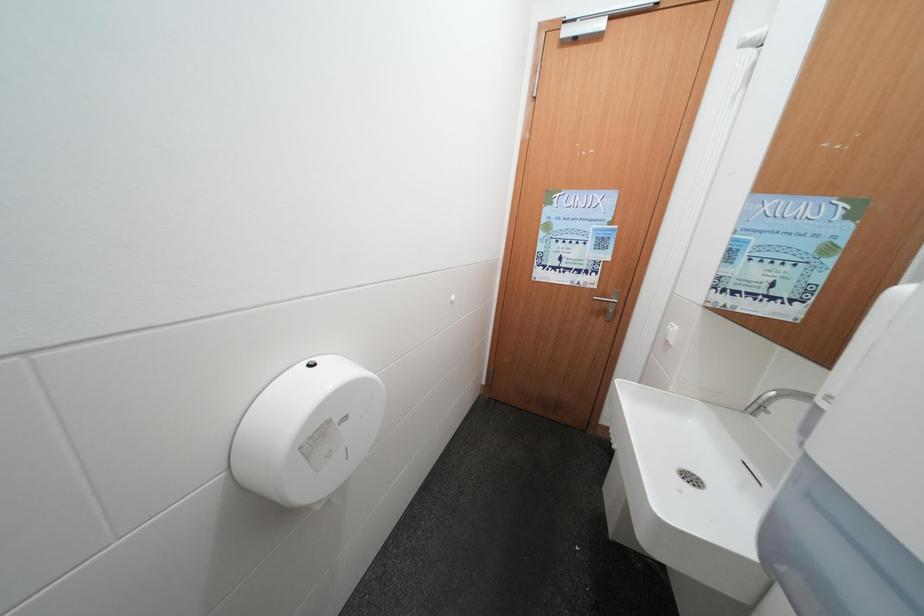
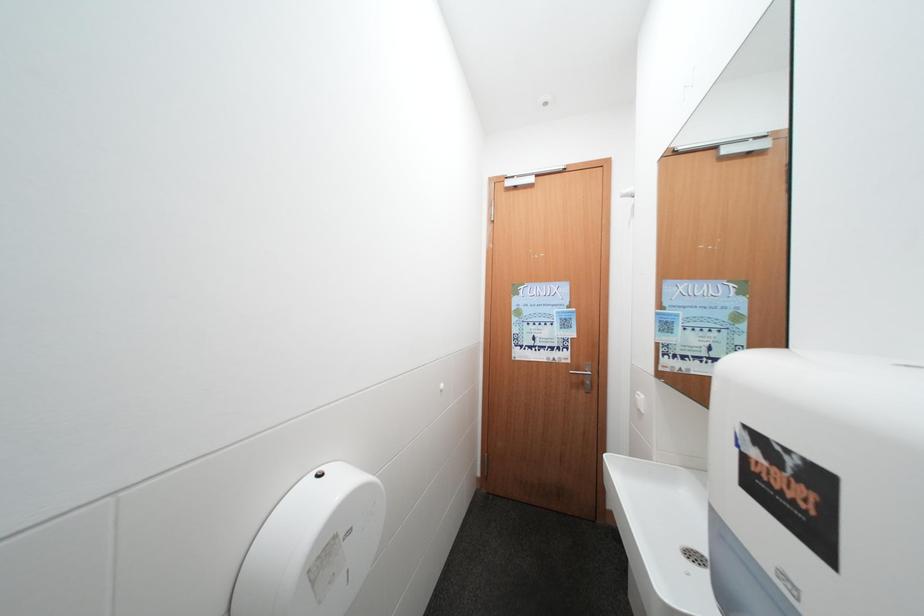
Question: Which direction would the cameraman need to move to produce the second image? Reply with the corresponding letter.

Choices:
 (A) Left
 (B) Right
 (C) Forward
 (D) Backward

Answer: (D)